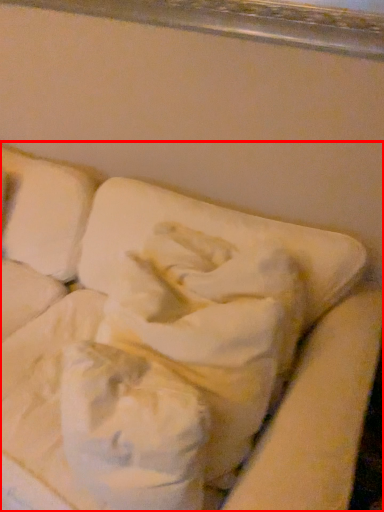
Question: Where is furniture (annotated by the red box) located in relation to pillow in the image?

Choices:
 (A) right
 (B) left

Answer: (B)